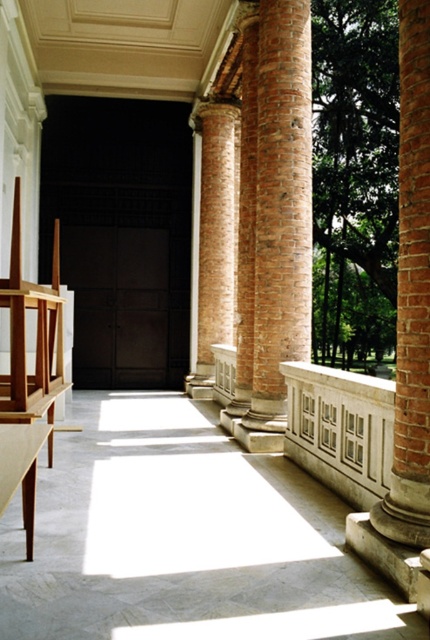
Who is taller, brown textured column at center or brick textured column at center?

brown textured column at center is taller.

Which is behind, point (310, 184) or point (221, 218)?

The point (221, 218) is behind.

Between point (255, 433) and point (218, 154), which one is positioned behind?

The point (218, 154) is behind.

Image resolution: width=430 pixels, height=640 pixels. Identify the location of brown textured column at center. (280, 216).

Who is lower down, white stone balustrade at center or brick textured column at center?

white stone balustrade at center is lower down.

Between white stone balustrade at center and brick textured column at center, which one has less height?

Standing shorter between the two is white stone balustrade at center.

Does point (325, 371) lie behind point (223, 324)?

No, it is in front of (223, 324).

You are a GUI agent. You are given a task and a screenshot of the screen. Output one action in this format:
    pyautogui.click(x=<x>, y=<y>)
    Task: Click on the white stone balustrade at center
    The width and height of the screenshot is (430, 640).
    Given the screenshot: What is the action you would take?
    pyautogui.click(x=340, y=429)

Can you confirm if brick column at right is positioned to the right of brick textured column at center?

Yes, brick column at right is to the right of brick textured column at center.

Between point (412, 29) and point (202, 340), which one is positioned behind?

Positioned behind is point (202, 340).

Who is more forward, [423,268] or [218,337]?

Positioned in front is point [423,268].

You are a GUI agent. You are given a task and a screenshot of the screen. Output one action in this format:
    pyautogui.click(x=<x>, y=<y>)
    Task: Click on the brick column at right
    The width and height of the screenshot is (430, 640).
    Given the screenshot: What is the action you would take?
    pyautogui.click(x=411, y=292)